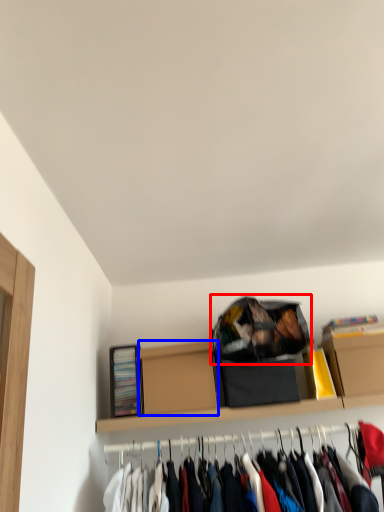
Question: Which object appears closest to the camera in this image, bag (highlighted by a red box) or cardboard box (highlighted by a blue box)?

Choices:
 (A) bag
 (B) cardboard box

Answer: (A)